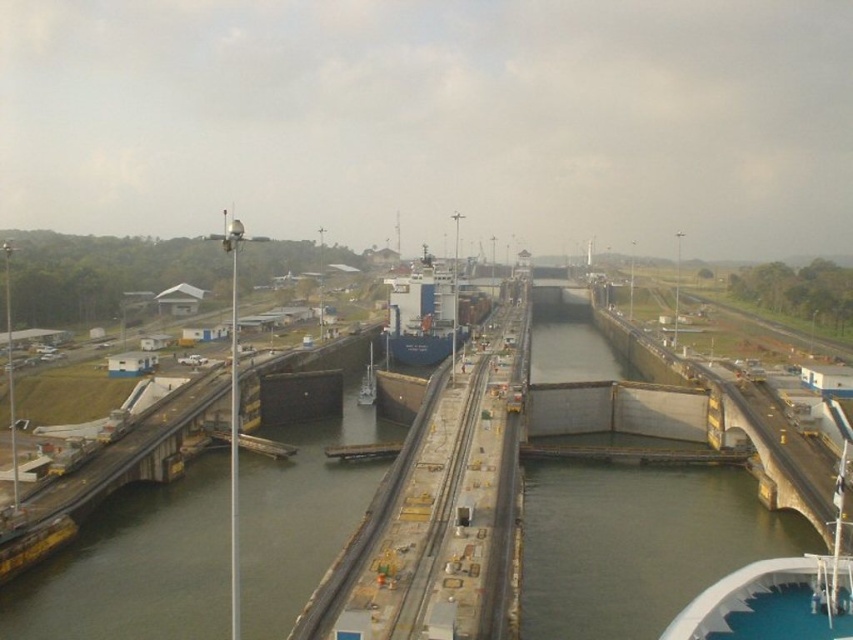
This screenshot has height=640, width=853. What do you see at coordinates (636, 545) in the screenshot?
I see `gray concrete lock at center` at bounding box center [636, 545].

Between point (549, 579) and point (392, 285), which one is positioned in front?

Positioned in front is point (549, 579).

Locate an element on the screen. The image size is (853, 640). gray concrete lock at center is located at coordinates (636, 545).

This screenshot has width=853, height=640. Find the location of `gray concrete lock at center`. gray concrete lock at center is located at coordinates point(636,545).

Between gray concrete lock at center and blue matte ship at center, which one has less height?

blue matte ship at center is shorter.

Does gray concrete lock at center have a greater height compared to blue matte ship at center?

Indeed, gray concrete lock at center has a greater height compared to blue matte ship at center.

The width and height of the screenshot is (853, 640). Identify the location of gray concrete lock at center. (636, 545).

Which is in front, point (433, 264) or point (370, 355)?

Point (370, 355) is in front.

From the picture: Is blue matte container ship at center above blue matte ship at center?

Indeed, blue matte container ship at center is positioned over blue matte ship at center.

You are a GUI agent. You are given a task and a screenshot of the screen. Output one action in this format:
    pyautogui.click(x=<x>, y=<y>)
    Task: Click on the blue matte container ship at center
    Image resolution: width=853 pixels, height=640 pixels.
    Given the screenshot: What is the action you would take?
    pyautogui.click(x=422, y=316)